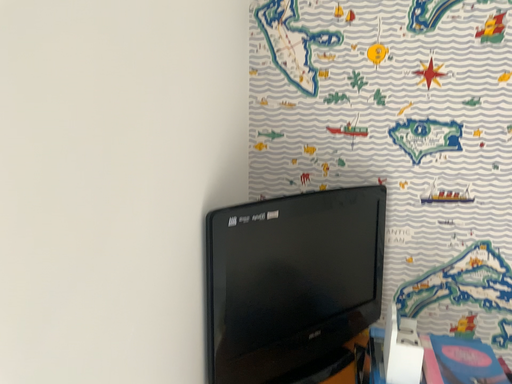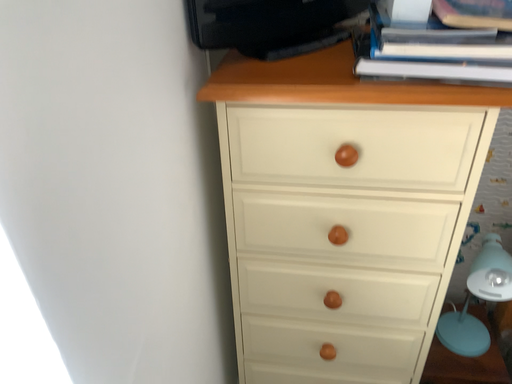
Question: How did the camera likely rotate when shooting the video?

Choices:
 (A) rotated upward
 (B) rotated downward

Answer: (B)